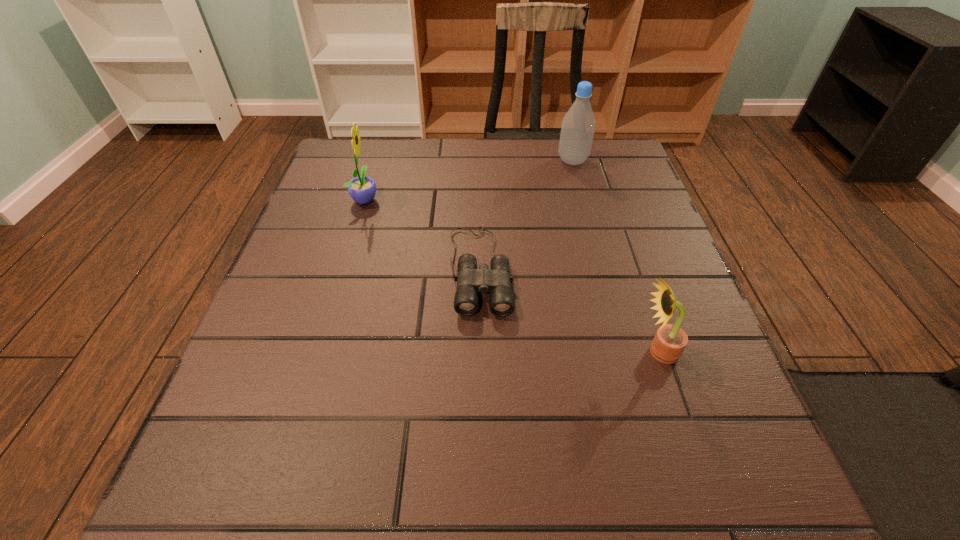
What are the coordinates of `vacant area between the bottle and the second farthest object` in the screenshot? It's located at (469, 180).

The width and height of the screenshot is (960, 540). In order to click on free space between the nearer sunflower and the leftmost object in this screenshot , I will do `click(512, 275)`.

The image size is (960, 540). What are the coordinates of `vacant area that lies between the nearer sunflower and the third farthest object` in the screenshot? It's located at (569, 310).

This screenshot has height=540, width=960. I want to click on free space between the nearest object and the bottle, so click(x=615, y=256).

The height and width of the screenshot is (540, 960). I want to click on free space between the nearest object and the farthest object, so click(x=615, y=256).

Locate an element on the screen. object that is the nearest to the nearest object is located at coordinates tap(496, 281).

Locate which object ranks third in proximity to the farthest object. Please provide its 2D coordinates. Your answer should be formatted as a tuple, i.e. [(x, y)], where the tuple contains the x and y coordinates of a point satisfying the conditions above.

[(669, 342)]

At what (x,y) coordinates should I click in order to perform the action: click on vacant area that satisfies the following two spatial constraints: 1. on the front side of the farthest object; 2. on the front-facing side of the leftmost object. Please return your answer as a coordinate pair (x, y). This screenshot has height=540, width=960. Looking at the image, I should click on (583, 199).